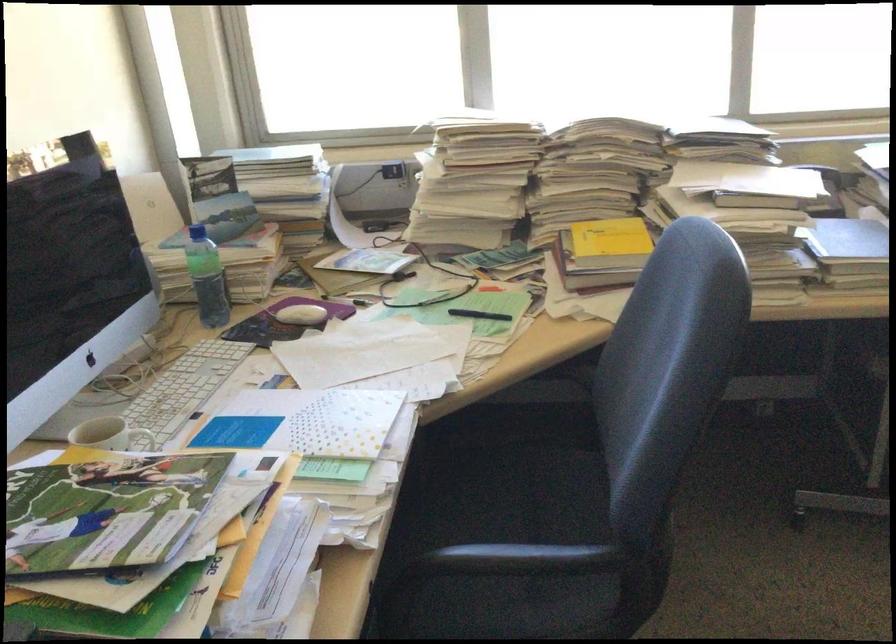
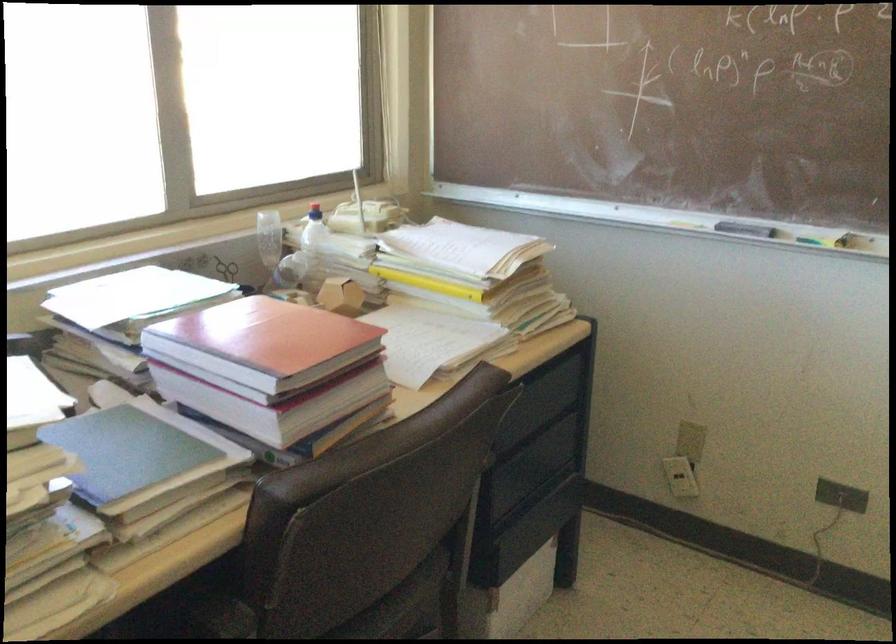
Question: The camera is either moving clockwise (left) or counter-clockwise (right) around the object. The first image is from the beginning of the video and the second image is from the end. Is the camera moving left or right when shooting the video?

Choices:
 (A) Left
 (B) Right

Answer: (A)